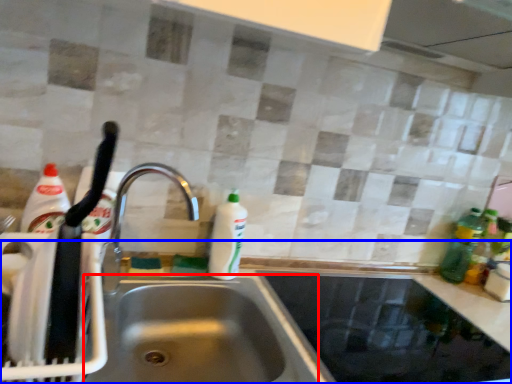
Question: Which object is closer to the camera taking this photo, sink (highlighted by a red box) or counter top (highlighted by a blue box)?

Choices:
 (A) sink
 (B) counter top

Answer: (B)